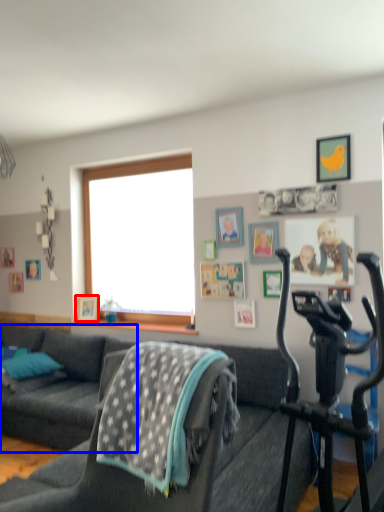
Question: Which object appears farthest to the camera in this image, picture frame (highlighted by a red box) or studio couch (highlighted by a blue box)?

Choices:
 (A) picture frame
 (B) studio couch

Answer: (A)